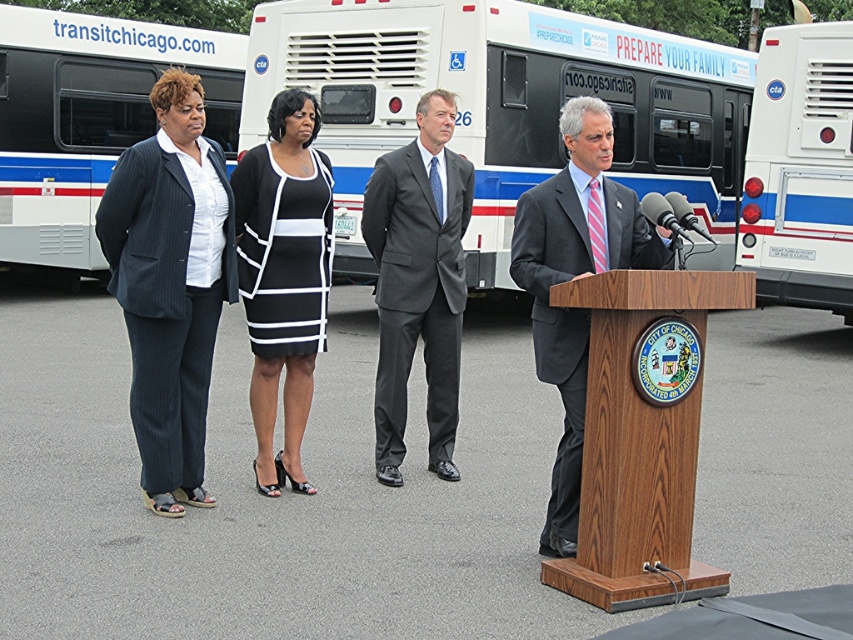
Based on the photo, you are a photographer at the press conference and need to capture a photo of both the black and white striped dress at center and the dark gray pinstripe pantsuit at left. Based on their positions, which one should you focus on first to ensure both are in frame?

The black and white striped dress at center is positioned on the right side of dark gray pinstripe pantsuit at left, so you should focus on the dark gray pinstripe pantsuit at left first to ensure both are in frame.

You are attending a press conference and want to know which of the two points, point (682, 550) or point (297, 348), is closer to you. Based on the scene description, can you determine this?

Point (682, 550) is closer to the viewer than point (297, 348).